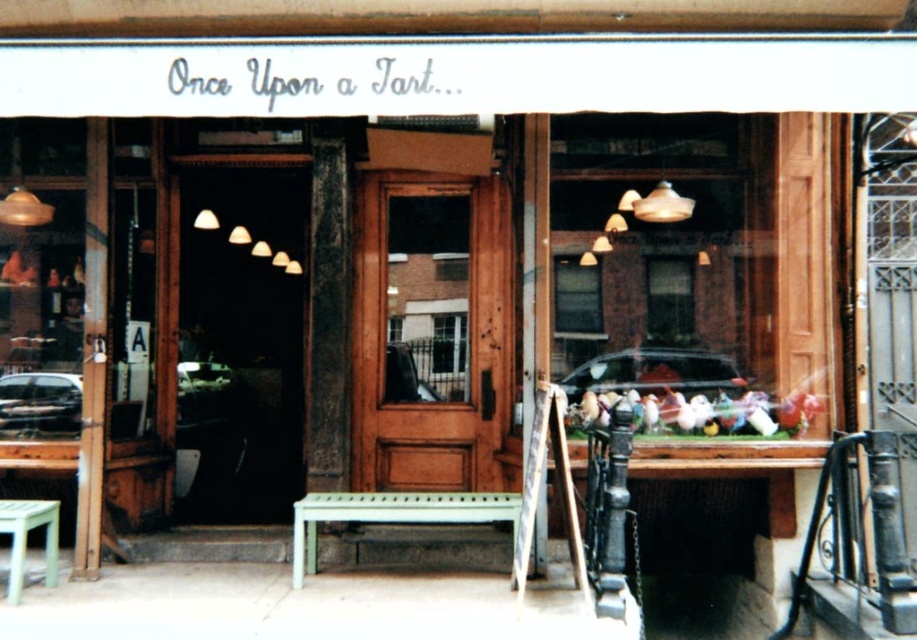
You are a customer approaching the entrance of the store. You see the wooden door at center and the green matte stool at lower left. Which object is closer to your current position?

The green matte stool at lower left is closer to your current position because the wooden door at center is positioned on the right side of it, meaning the stool is in front of the door.

You are standing in front of the store entrance. Where is the wooden door at center located in relation to your viewpoint?

The wooden door at center is located at point (431,333) in relation to your viewpoint.

You are a customer arriving at the Once Upon a Tart... store. You want to sit on the green painted wood bench at center. To do so, should you step over or walk around the wooden door at center?

The wooden door at center is above the green painted wood bench at center, so you can simply step over the wooden door at center to reach the green painted wood bench at center.